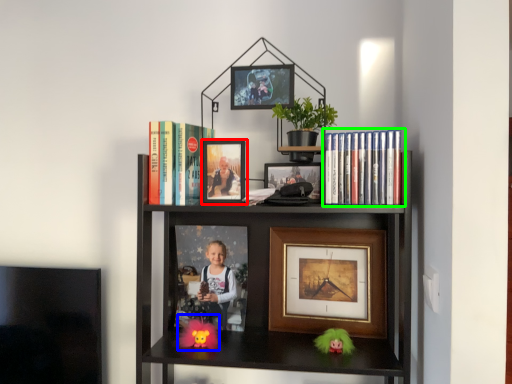
Question: Considering the real-world distances, which object is farthest from picture frame (highlighted by a red box)? toy (highlighted by a blue box) or book (highlighted by a green box)?

Choices:
 (A) toy
 (B) book

Answer: (A)